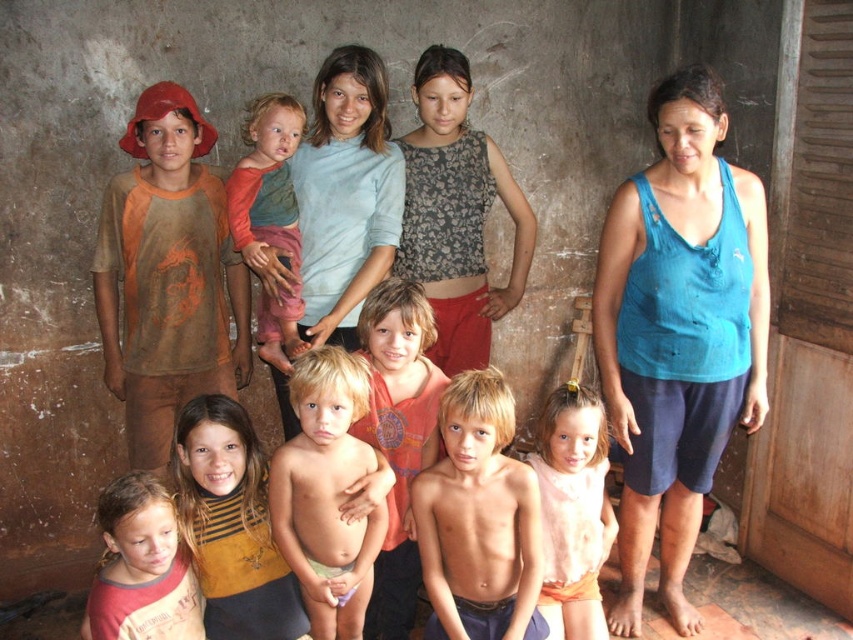
Who is positioned more to the left, blue fabric tank top at right or blonde hair baby at center?

From the viewer's perspective, blonde hair baby at center appears more on the left side.

Between blue fabric tank top at right and blonde hair baby at center, which one is positioned lower?

blonde hair baby at center

The height and width of the screenshot is (640, 853). What are the coordinates of `blue fabric tank top at right` in the screenshot? It's located at (677, 332).

From the picture: Between pink fabric dress at lower center and orange long-sleeve shirt at center, which one has more height?

orange long-sleeve shirt at center

Can you confirm if pink fabric dress at lower center is taller than orange long-sleeve shirt at center?

No.

Does point (601, 456) come behind point (299, 253)?

No.

Find the location of a particular element. The image size is (853, 640). pink fabric dress at lower center is located at coordinates (573, 509).

Is orange cotton shirt at center bigger than pink fabric dress at lower center?

Yes.

Who is higher up, orange cotton shirt at center or pink fabric dress at lower center?

orange cotton shirt at center is higher up.

This screenshot has width=853, height=640. I want to click on orange cotton shirt at center, so click(x=398, y=436).